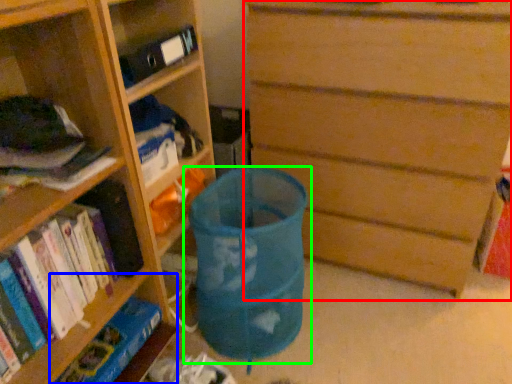
Question: Which object is the closest to the chest of drawers (highlighted by a red box)? Choose among these: shelf (highlighted by a blue box) or waste container (highlighted by a green box).

Choices:
 (A) shelf
 (B) waste container

Answer: (B)